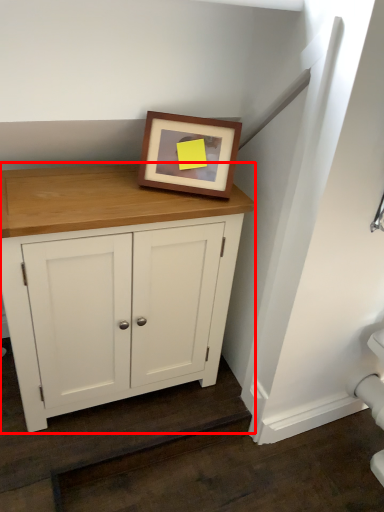
Question: From the image's perspective, considering the relative positions of cupboard (annotated by the red box) and picture frame in the image provided, where is cupboard (annotated by the red box) located with respect to the staircase?

Choices:
 (A) below
 (B) above

Answer: (A)